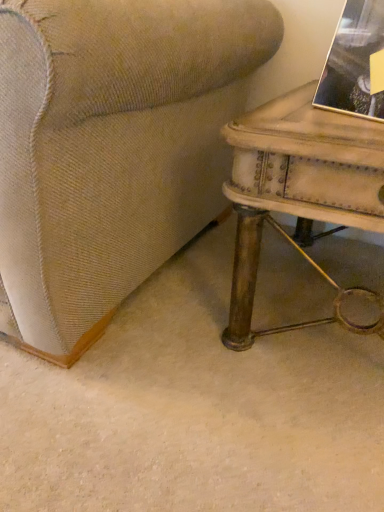
Question: Is rustic wood table at right wider or thinner than gold-framed photo at upper right?

Choices:
 (A) wide
 (B) thin

Answer: (A)

Question: Considering their positions, is rustic wood table at right located in front of or behind gold-framed photo at upper right?

Choices:
 (A) behind
 (B) front

Answer: (B)

Question: From the image's perspective, is rustic wood table at right positioned above or below gold-framed photo at upper right?

Choices:
 (A) above
 (B) below

Answer: (B)

Question: Based on their sizes in the image, would you say gold-framed photo at upper right is bigger or smaller than rustic wood table at right?

Choices:
 (A) big
 (B) small

Answer: (B)

Question: Does point (359, 38) appear closer or farther from the camera than point (240, 256)?

Choices:
 (A) farther
 (B) closer

Answer: (B)

Question: Is gold-framed photo at upper right wider or thinner than rustic wood table at right?

Choices:
 (A) thin
 (B) wide

Answer: (A)

Question: Based on their positions, is gold-framed photo at upper right located to the left or right of rustic wood table at right?

Choices:
 (A) left
 (B) right

Answer: (B)